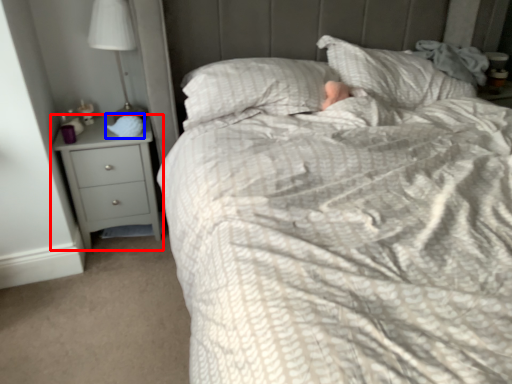
Question: Among these objects, which one is nearest to the camera, chest of drawers (highlighted by a red box) or sleeping bag (highlighted by a blue box)?

Choices:
 (A) chest of drawers
 (B) sleeping bag

Answer: (A)